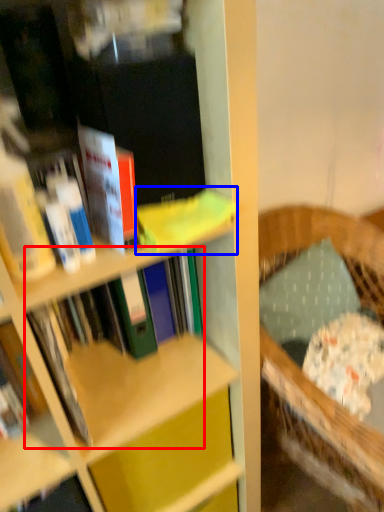
Question: Which point is further to the camera, book (highlighted by a red box) or book (highlighted by a blue box)?

Choices:
 (A) book
 (B) book

Answer: (A)